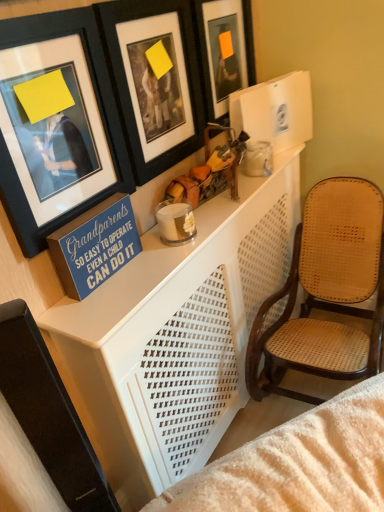
Question: Considering the positions of black matte picture frame at upper center, the second picture frame in the left-to-right sequence, and blue painted wood sign at upper left in the image, is black matte picture frame at upper center, the second picture frame in the left-to-right sequence, bigger or smaller than blue painted wood sign at upper left?

Choices:
 (A) big
 (B) small

Answer: (A)

Question: Considering the positions of point (127, 65) and point (114, 260), is point (127, 65) closer or farther from the camera than point (114, 260)?

Choices:
 (A) farther
 (B) closer

Answer: (A)

Question: Which is nearer to the white perforated table at center?

Choices:
 (A) black matte picture frame at upper center, the 2th picture frame when ordered from right to left
 (B) matte black picture frame at upper left, marked as the first picture frame in a left-to-right arrangement
 (C) orange matte picture frame at upper center, acting as the 1th picture frame starting from the right
 (D) blue painted wood sign at upper left

Answer: (D)

Question: Estimate the real-world distances between objects in this image. Which object is closer to the blue painted wood sign at upper left?

Choices:
 (A) white perforated table at center
 (B) black matte picture frame at upper center, the second picture frame in the left-to-right sequence
 (C) orange matte picture frame at upper center, acting as the 1th picture frame starting from the right
 (D) matte black picture frame at upper left, acting as the third picture frame starting from the right

Answer: (D)